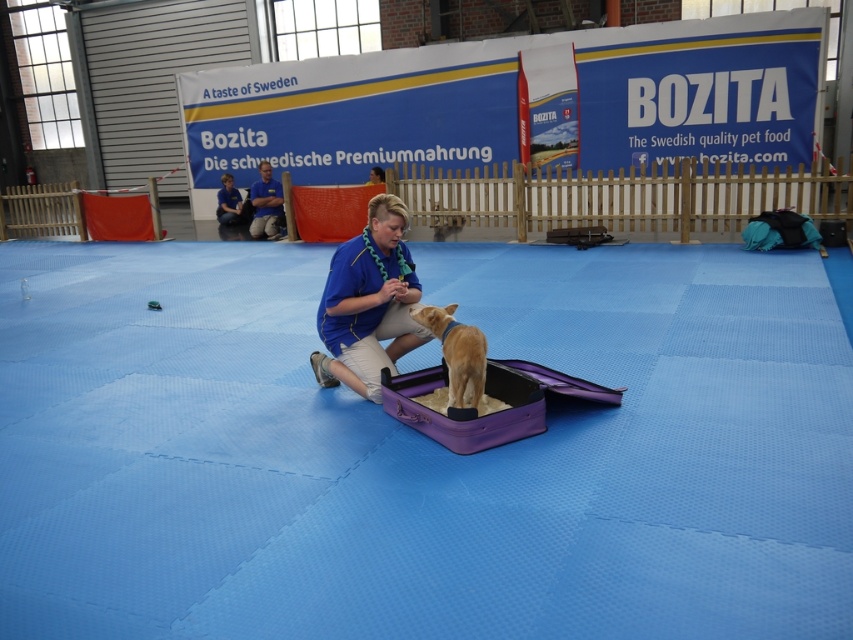
Question: Can you confirm if blue fabric squat at center is thinner than golden fur dog at center?

Choices:
 (A) yes
 (B) no

Answer: (B)

Question: Which object appears closest to the camera in this image?

Choices:
 (A) blue shirt at center
 (B) golden fur dog at center
 (C) blue fabric squat at center

Answer: (B)

Question: Considering the relative positions of blue fabric squat at center and golden fur dog at center in the image provided, where is blue fabric squat at center located with respect to golden fur dog at center?

Choices:
 (A) above
 (B) below

Answer: (A)

Question: Among these points, which one is nearest to the camera?

Choices:
 (A) (469, 384)
 (B) (378, 228)
 (C) (281, 192)

Answer: (A)

Question: Which object appears farthest from the camera in this image?

Choices:
 (A) blue fabric squat at center
 (B) blue shirt at center
 (C) golden fur dog at center

Answer: (B)

Question: Is golden fur dog at center to the right of blue shirt at center from the viewer's perspective?

Choices:
 (A) yes
 (B) no

Answer: (A)